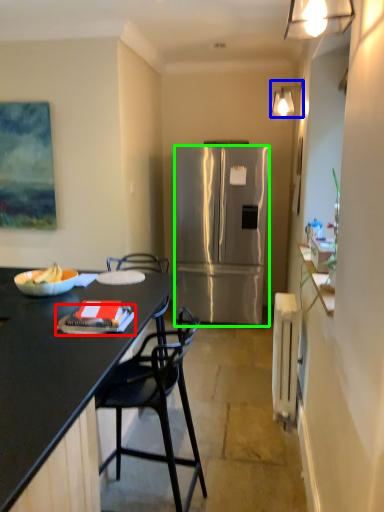
Question: Which is nearer to the book (highlighted by a red box)? lamp (highlighted by a blue box) or refrigerator (highlighted by a green box).

Choices:
 (A) lamp
 (B) refrigerator

Answer: (B)